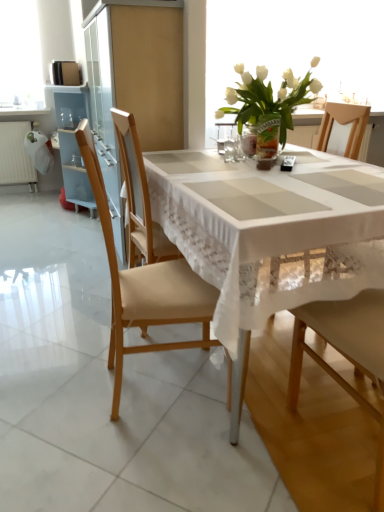
Question: From a real-world perspective, is translucent glass vase at center, which appears as the 2th tableware when viewed from the right, over light brown wood chair at left, the first chair when ordered from left to right?

Choices:
 (A) no
 (B) yes

Answer: (B)

Question: Is translucent glass vase at center, which appears as the 2th tableware when viewed from the right, outside light brown wood chair at left, the first chair when ordered from left to right?

Choices:
 (A) yes
 (B) no

Answer: (A)

Question: Is the surface of translucent glass vase at center, which is counted as the 1th tableware, starting from the left, in direct contact with light brown wood chair at left, acting as the 2th chair starting from the right?

Choices:
 (A) yes
 (B) no

Answer: (B)

Question: From the image's perspective, is translucent glass vase at center, which appears as the 2th tableware when viewed from the right, below light brown wood chair at left, the first chair when ordered from left to right?

Choices:
 (A) yes
 (B) no

Answer: (B)

Question: Is light brown wood chair at left, the first chair when ordered from left to right, a part of translucent glass vase at center, which appears as the 2th tableware when viewed from the right?

Choices:
 (A) yes
 (B) no

Answer: (B)

Question: Considering the relative sizes of translucent glass vase at center, which appears as the 2th tableware when viewed from the right, and light brown wood chair at left, acting as the 2th chair starting from the right, in the image provided, is translucent glass vase at center, which appears as the 2th tableware when viewed from the right, bigger than light brown wood chair at left, acting as the 2th chair starting from the right,?

Choices:
 (A) no
 (B) yes

Answer: (A)

Question: Considering the relative positions of clear glass vase at center, the second tableware viewed from the left, and translucent glass vase at center, which appears as the 2th tableware when viewed from the right, in the image provided, is clear glass vase at center, the second tableware viewed from the left, to the left of translucent glass vase at center, which appears as the 2th tableware when viewed from the right, from the viewer's perspective?

Choices:
 (A) no
 (B) yes

Answer: (A)

Question: Is clear glass vase at center, which appears as the first tableware when viewed from the right, in front of translucent glass vase at center, which appears as the 2th tableware when viewed from the right?

Choices:
 (A) no
 (B) yes

Answer: (A)

Question: From a real-world perspective, does clear glass vase at center, which appears as the first tableware when viewed from the right, stand above translucent glass vase at center, which is counted as the 1th tableware, starting from the left?

Choices:
 (A) yes
 (B) no

Answer: (A)

Question: Can you confirm if clear glass vase at center, which appears as the first tableware when viewed from the right, is bigger than translucent glass vase at center, which is counted as the 1th tableware, starting from the left?

Choices:
 (A) yes
 (B) no

Answer: (B)

Question: Does clear glass vase at center, the second tableware viewed from the left, touch translucent glass vase at center, which is counted as the 1th tableware, starting from the left?

Choices:
 (A) no
 (B) yes

Answer: (B)

Question: From a real-world perspective, is clear glass vase at center, which appears as the first tableware when viewed from the right, beneath translucent glass vase at center, which is counted as the 1th tableware, starting from the left?

Choices:
 (A) no
 (B) yes

Answer: (A)

Question: Does white glass vase at upper center have a lesser height compared to light brown wood chair at left, acting as the 2th chair starting from the right?

Choices:
 (A) no
 (B) yes

Answer: (B)